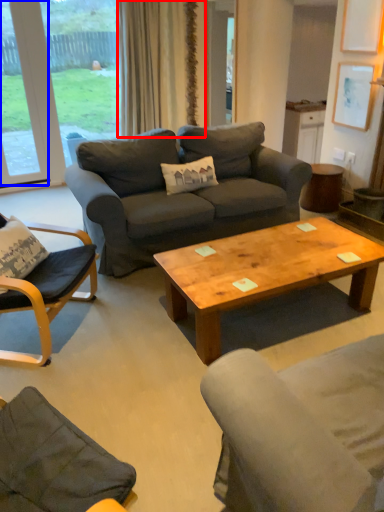
Question: Which point is closer to the camera, curtain (highlighted by a red box) or window (highlighted by a blue box)?

Choices:
 (A) curtain
 (B) window

Answer: (B)